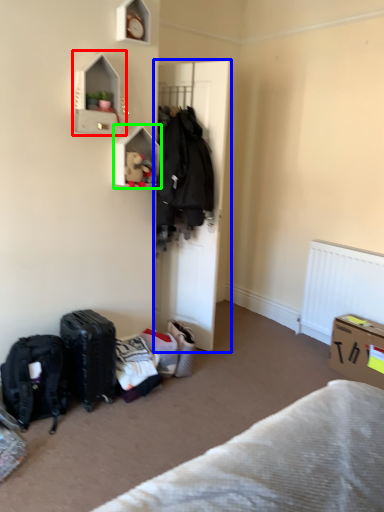
Question: Considering the real-world distances, which object is farthest from cabinet (highlighted by a red box)? door (highlighted by a blue box) or shelf (highlighted by a green box)?

Choices:
 (A) door
 (B) shelf

Answer: (A)